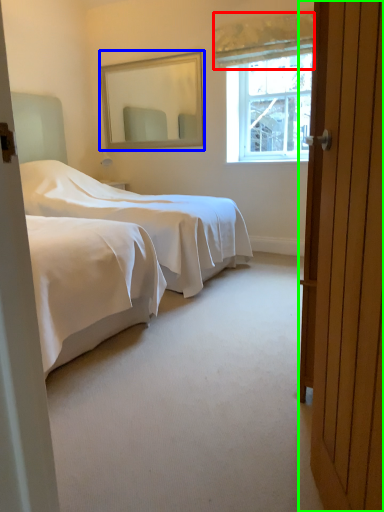
Question: Estimate the real-world distances between objects in this image. Which object is farther from curtain (highlighted by a red box), mirror (highlighted by a blue box) or door (highlighted by a green box)?

Choices:
 (A) mirror
 (B) door

Answer: (B)